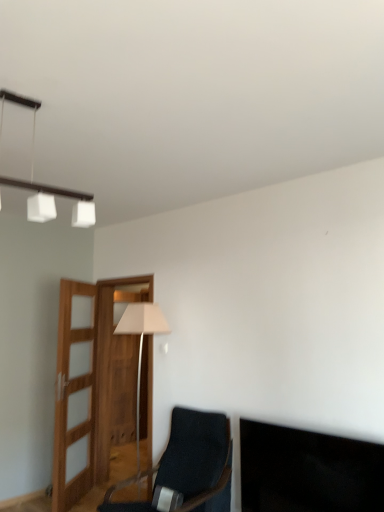
Question: From a real-world perspective, is black glossy tv at lower right positioned under dark blue fabric chair at center based on gravity?

Choices:
 (A) yes
 (B) no

Answer: (B)

Question: Are black glossy tv at lower right and dark blue fabric chair at center far apart?

Choices:
 (A) yes
 (B) no

Answer: (B)

Question: Can you confirm if black glossy tv at lower right is thinner than dark blue fabric chair at center?

Choices:
 (A) no
 (B) yes

Answer: (B)

Question: Is black glossy tv at lower right further to the viewer compared to dark blue fabric chair at center?

Choices:
 (A) yes
 (B) no

Answer: (B)

Question: Can we say black glossy tv at lower right lies outside dark blue fabric chair at center?

Choices:
 (A) yes
 (B) no

Answer: (A)

Question: Considering their positions, is white fabric lampshade at center located in front of or behind white matte cube at upper left?

Choices:
 (A) front
 (B) behind

Answer: (B)

Question: In the image, is white fabric lampshade at center on the left side or the right side of white matte cube at upper left?

Choices:
 (A) right
 (B) left

Answer: (A)

Question: Which is correct: white fabric lampshade at center is inside white matte cube at upper left, or outside of it?

Choices:
 (A) outside
 (B) inside

Answer: (A)

Question: Based on their sizes in the image, would you say white fabric lampshade at center is bigger or smaller than white matte cube at upper left?

Choices:
 (A) big
 (B) small

Answer: (A)

Question: Considering the positions of point (140, 331) and point (200, 479), is point (140, 331) closer or farther from the camera than point (200, 479)?

Choices:
 (A) farther
 (B) closer

Answer: (A)

Question: From the image's perspective, is white fabric lampshade at center located above or below dark blue fabric chair at center?

Choices:
 (A) above
 (B) below

Answer: (A)

Question: Considering the positions of white fabric lampshade at center and dark blue fabric chair at center in the image, is white fabric lampshade at center wider or thinner than dark blue fabric chair at center?

Choices:
 (A) wide
 (B) thin

Answer: (B)

Question: Is white fabric lampshade at center bigger or smaller than dark blue fabric chair at center?

Choices:
 (A) small
 (B) big

Answer: (A)

Question: Is point (29, 206) closer or farther from the camera than point (327, 463)?

Choices:
 (A) closer
 (B) farther

Answer: (A)

Question: Considering the positions of white matte cube at upper left and black glossy tv at lower right in the image, is white matte cube at upper left bigger or smaller than black glossy tv at lower right?

Choices:
 (A) big
 (B) small

Answer: (B)